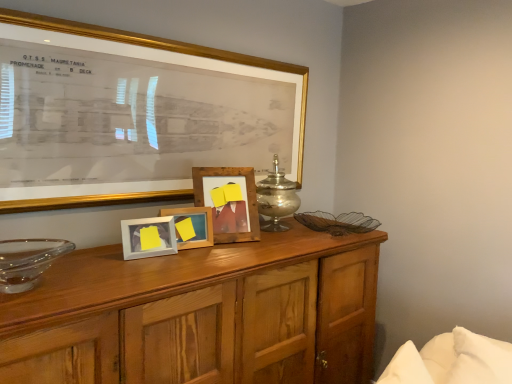
Image resolution: width=512 pixels, height=384 pixels. Find the location of `free point above gold framed picture at upper center, placed as the fourth picture frame when sorted from back to front (from a real-world perspective)`. free point above gold framed picture at upper center, placed as the fourth picture frame when sorted from back to front (from a real-world perspective) is located at coordinates (179, 34).